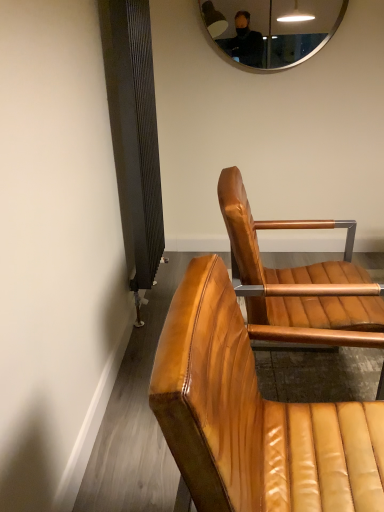
The height and width of the screenshot is (512, 384). I want to click on shiny brown leather chair at center, marked as the second chair in a front-to-back arrangement, so click(x=299, y=283).

From a real-world perspective, is leather chair at center, arranged as the first chair when viewed from the front, physically below silver metallic mirror at upper center?

Yes, from a real-world perspective, leather chair at center, arranged as the first chair when viewed from the front, is under silver metallic mirror at upper center.

From the image's perspective, between leather chair at center, which is the second chair from back to front, and silver metallic mirror at upper center, who is located below?

leather chair at center, which is the second chair from back to front, appears lower in the image.

Between leather chair at center, which is the second chair from back to front, and silver metallic mirror at upper center, which one appears on the right side from the viewer's perspective?

silver metallic mirror at upper center is more to the right.

Identify the location of chair that is the 2nd object to the left of the silver metallic mirror at upper center, starting at the anchor. This screenshot has width=384, height=512. (253, 416).

Would you say silver metallic mirror at upper center is outside leather chair at center, which is the second chair from back to front?

That's correct, silver metallic mirror at upper center is outside of leather chair at center, which is the second chair from back to front.

How many degrees apart are the facing directions of silver metallic mirror at upper center and leather chair at center, which is the second chair from back to front?

silver metallic mirror at upper center and leather chair at center, which is the second chair from back to front, are facing 86.4 degrees away from each other.

Between silver metallic mirror at upper center and leather chair at center, arranged as the first chair when viewed from the front, which one is positioned behind?

silver metallic mirror at upper center.

From a real-world perspective, is silver metallic mirror at upper center over leather chair at center, arranged as the first chair when viewed from the front?

Yes, from a real-world perspective, silver metallic mirror at upper center is on top of leather chair at center, arranged as the first chair when viewed from the front.

Is shiny brown leather chair at center, the first chair when ordered from back to front, wider or thinner than leather chair at center, arranged as the first chair when viewed from the front?

In the image, shiny brown leather chair at center, the first chair when ordered from back to front, appears to be wider than leather chair at center, arranged as the first chair when viewed from the front.

From the image's perspective, is shiny brown leather chair at center, marked as the second chair in a front-to-back arrangement, above or below leather chair at center, which is the second chair from back to front?

Clearly, from the image's perspective, shiny brown leather chair at center, marked as the second chair in a front-to-back arrangement, is above leather chair at center, which is the second chair from back to front.

Is shiny brown leather chair at center, the first chair when ordered from back to front, touching leather chair at center, which is the second chair from back to front?

No, shiny brown leather chair at center, the first chair when ordered from back to front, is not with leather chair at center, which is the second chair from back to front.

Is shiny brown leather chair at center, marked as the second chair in a front-to-back arrangement, wider or thinner than silver metallic mirror at upper center?

shiny brown leather chair at center, marked as the second chair in a front-to-back arrangement, is wider than silver metallic mirror at upper center.

From the image's perspective, which chair is the 1st one below the silver metallic mirror at upper center? Please provide its 2D coordinates.

[(299, 283)]

Is shiny brown leather chair at center, marked as the second chair in a front-to-back arrangement, to the right of silver metallic mirror at upper center from the viewer's perspective?

No.

Is shiny brown leather chair at center, marked as the second chair in a front-to-back arrangement, not within silver metallic mirror at upper center?

Yes, shiny brown leather chair at center, marked as the second chair in a front-to-back arrangement, is not within silver metallic mirror at upper center.

Does leather chair at center, arranged as the first chair when viewed from the front, have a greater width compared to shiny brown leather chair at center, the first chair when ordered from back to front?

Incorrect, the width of leather chair at center, arranged as the first chair when viewed from the front, does not surpass that of shiny brown leather chair at center, the first chair when ordered from back to front.

Where is `chair on the right of leather chair at center, which is the second chair from back to front`? chair on the right of leather chair at center, which is the second chair from back to front is located at coordinates (299, 283).

In the scene shown: Which of these two, leather chair at center, which is the second chair from back to front, or shiny brown leather chair at center, the first chair when ordered from back to front, is bigger?

Bigger between the two is shiny brown leather chair at center, the first chair when ordered from back to front.

Could you tell me if leather chair at center, which is the second chair from back to front, is turned towards shiny brown leather chair at center, the first chair when ordered from back to front?

No, leather chair at center, which is the second chair from back to front, is not aimed at shiny brown leather chair at center, the first chair when ordered from back to front.

Can you confirm if silver metallic mirror at upper center is thinner than shiny brown leather chair at center, the first chair when ordered from back to front?

Yes, silver metallic mirror at upper center is thinner than shiny brown leather chair at center, the first chair when ordered from back to front.

Based on the photo, from the image's perspective, which one is positioned lower, silver metallic mirror at upper center or shiny brown leather chair at center, marked as the second chair in a front-to-back arrangement?

shiny brown leather chair at center, marked as the second chair in a front-to-back arrangement, is shown below in the image.

Where is `mirror lying behind the shiny brown leather chair at center, the first chair when ordered from back to front`? mirror lying behind the shiny brown leather chair at center, the first chair when ordered from back to front is located at coordinates (271, 29).

Locate an element on the screen. The image size is (384, 512). mirror located on the right of leather chair at center, which is the second chair from back to front is located at coordinates pos(271,29).

The width and height of the screenshot is (384, 512). I want to click on mirror behind the leather chair at center, which is the second chair from back to front, so click(x=271, y=29).

Based on their spatial positions, is leather chair at center, which is the second chair from back to front, or shiny brown leather chair at center, the first chair when ordered from back to front, further from silver metallic mirror at upper center?

leather chair at center, which is the second chair from back to front, lies further to silver metallic mirror at upper center than the other object.

Which object lies nearer to the anchor point shiny brown leather chair at center, marked as the second chair in a front-to-back arrangement, silver metallic mirror at upper center or leather chair at center, arranged as the first chair when viewed from the front?

The object closer to shiny brown leather chair at center, marked as the second chair in a front-to-back arrangement, is leather chair at center, arranged as the first chair when viewed from the front.

Based on their spatial positions, is silver metallic mirror at upper center or shiny brown leather chair at center, the first chair when ordered from back to front, further from leather chair at center, arranged as the first chair when viewed from the front?

The object further to leather chair at center, arranged as the first chair when viewed from the front, is silver metallic mirror at upper center.

When comparing their distances from silver metallic mirror at upper center, does shiny brown leather chair at center, marked as the second chair in a front-to-back arrangement, or leather chair at center, which is the second chair from back to front, seem further?

Based on the image, leather chair at center, which is the second chair from back to front, appears to be further to silver metallic mirror at upper center.

Which object lies nearer to the anchor point leather chair at center, which is the second chair from back to front, shiny brown leather chair at center, marked as the second chair in a front-to-back arrangement, or silver metallic mirror at upper center?

Based on the image, shiny brown leather chair at center, marked as the second chair in a front-to-back arrangement, appears to be nearer to leather chair at center, which is the second chair from back to front.

Considering their positions, is leather chair at center, which is the second chair from back to front, positioned closer to shiny brown leather chair at center, marked as the second chair in a front-to-back arrangement, than silver metallic mirror at upper center?

leather chair at center, which is the second chair from back to front, lies closer to shiny brown leather chair at center, marked as the second chair in a front-to-back arrangement, than the other object.

Find the location of `chair that lies between silver metallic mirror at upper center and leather chair at center, arranged as the first chair when viewed from the front, from top to bottom`. chair that lies between silver metallic mirror at upper center and leather chair at center, arranged as the first chair when viewed from the front, from top to bottom is located at coordinates (299, 283).